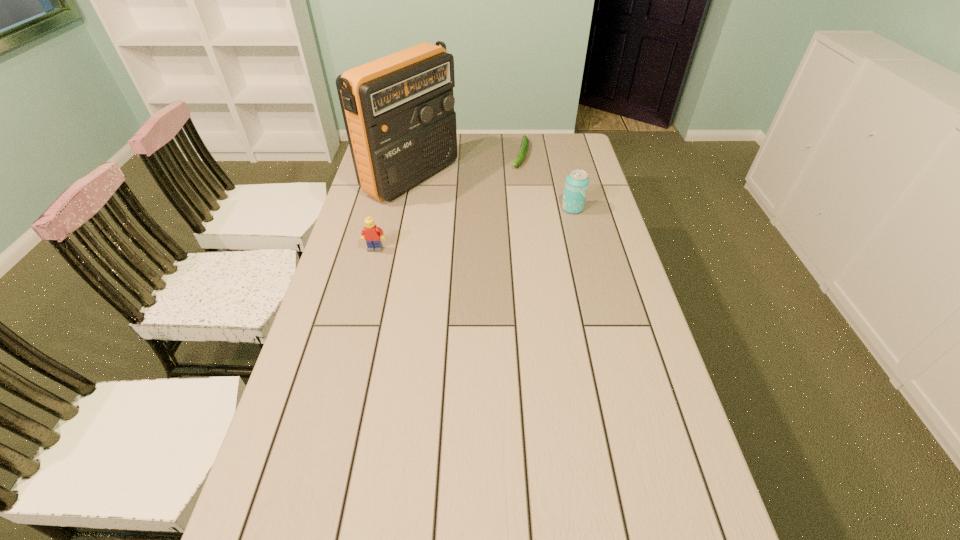
I want to click on free space between the beer can and the tallest object, so click(x=492, y=193).

Identify the location of free space between the Lego and the radio receiver. The image size is (960, 540). (393, 213).

At what (x,y) coordinates should I click in order to perform the action: click on free spot between the Lego and the zucchini. Please return your answer as a coordinate pair (x, y). Looking at the image, I should click on (448, 202).

Select which object appears as the second closest to the shortest object. Please provide its 2D coordinates. Your answer should be formatted as a tuple, i.e. [(x, y)], where the tuple contains the x and y coordinates of a point satisfying the conditions above.

[(577, 181)]

Locate which object ranks third in proximity to the beer can. Please provide its 2D coordinates. Your answer should be formatted as a tuple, i.e. [(x, y)], where the tuple contains the x and y coordinates of a point satisfying the conditions above.

[(371, 233)]